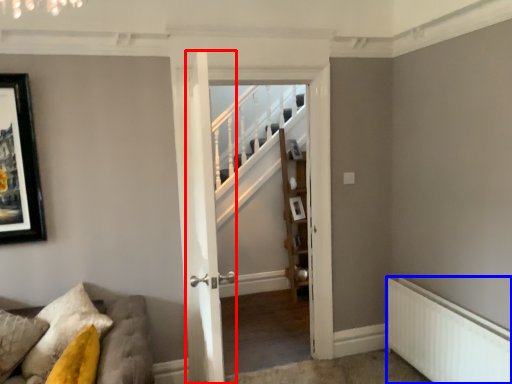
Question: Which point is further to the camera, door (highlighted by a red box) or radiator (highlighted by a blue box)?

Choices:
 (A) door
 (B) radiator

Answer: (B)